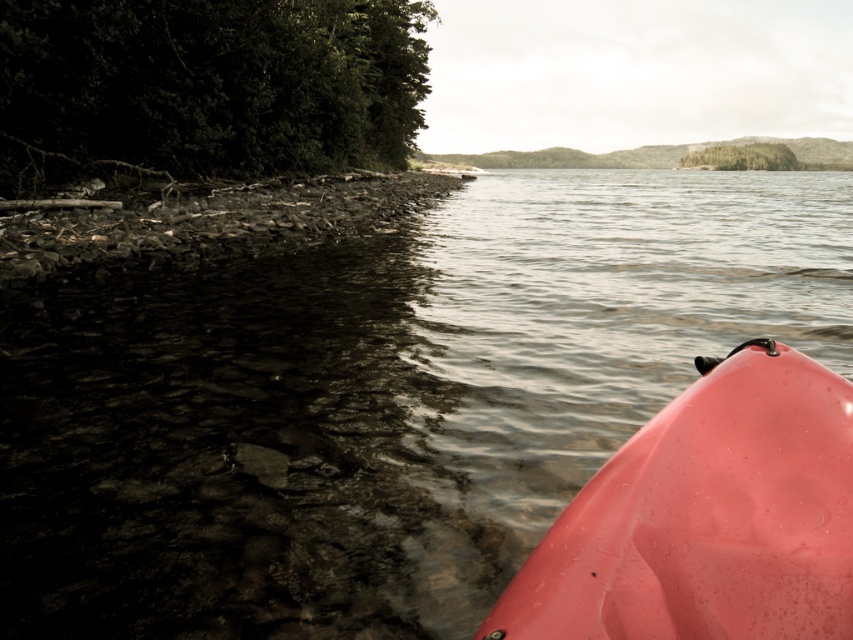
Question: Which point appears closest to the camera in this image?

Choices:
 (A) (302, 193)
 (B) (428, 468)
 (C) (496, 620)

Answer: (C)

Question: Does green leafy tree at upper left appear over rough stone shore at left?

Choices:
 (A) yes
 (B) no

Answer: (A)

Question: Which object is the farthest from the transparent water at lower right?

Choices:
 (A) rough stone shore at left
 (B) glossy plastic kayak at lower right

Answer: (B)

Question: Does glossy plastic kayak at lower right appear on the left side of rough stone shore at left?

Choices:
 (A) no
 (B) yes

Answer: (A)

Question: Which point is farther to the camera?

Choices:
 (A) glossy plastic kayak at lower right
 (B) transparent water at lower right

Answer: (B)

Question: Does glossy plastic kayak at lower right have a greater width compared to rough stone shore at left?

Choices:
 (A) yes
 (B) no

Answer: (B)